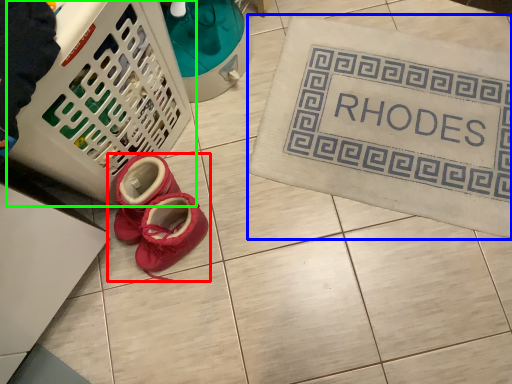
Question: Which is nearer to the footwear (highlighted by a red box)? bath mat (highlighted by a blue box) or basket (highlighted by a green box).

Choices:
 (A) bath mat
 (B) basket

Answer: (B)